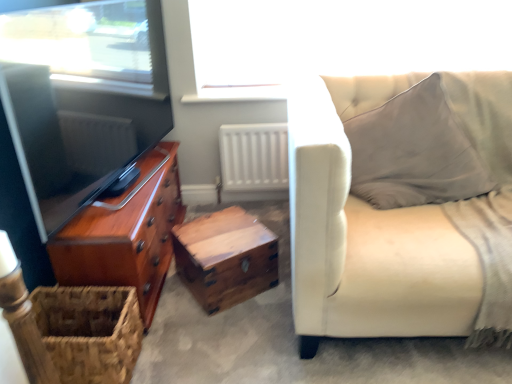
Question: From the image's perspective, is shiny brown chest of drawers at left located above or below white matte radiator at center?

Choices:
 (A) above
 (B) below

Answer: (B)

Question: Based on their positions, is shiny brown chest of drawers at left located to the left or right of white matte radiator at center?

Choices:
 (A) left
 (B) right

Answer: (A)

Question: Which object is positioned closest to the woven brown basket at lower left?

Choices:
 (A) light beige fabric couch at right
 (B) wooden trunk at center
 (C) shiny brown chest of drawers at left
 (D) transparent glass window at upper center
 (E) white matte radiator at center

Answer: (C)

Question: Which object is the closest to the wooden trunk at center?

Choices:
 (A) white matte radiator at center
 (B) light beige fabric couch at right
 (C) transparent glass window at upper center
 (D) shiny brown chest of drawers at left
 (E) woven brown basket at lower left

Answer: (D)